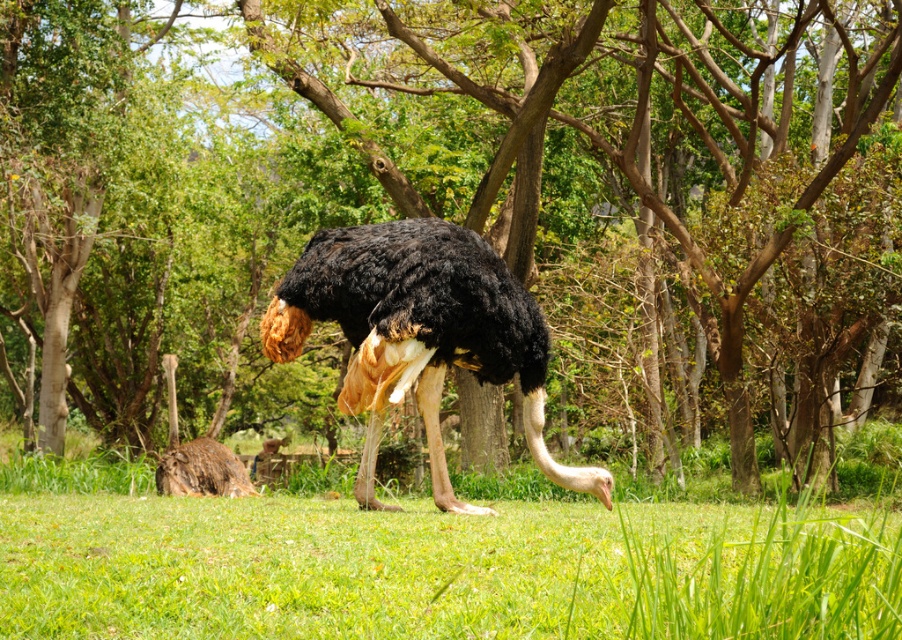
Question: Does green grassy at center have a greater width compared to black feathered ostrich at center?

Choices:
 (A) no
 (B) yes

Answer: (A)

Question: Is green grassy at center above brown feathered ostrich at lower left?

Choices:
 (A) no
 (B) yes

Answer: (B)

Question: Among these objects, which one is nearest to the camera?

Choices:
 (A) brown feathered ostrich at lower left
 (B) black feathered ostrich at center
 (C) green grassy at center

Answer: (C)

Question: Can you confirm if black feathered ostrich at center is positioned to the left of brown feathered ostrich at lower left?

Choices:
 (A) no
 (B) yes

Answer: (A)

Question: Which object appears farthest from the camera in this image?

Choices:
 (A) green grassy at center
 (B) black feathered ostrich at center
 (C) brown feathered ostrich at lower left

Answer: (C)

Question: Considering the real-world distances, which object is closest to the green grassy at center?

Choices:
 (A) brown feathered ostrich at lower left
 (B) black feathered ostrich at center

Answer: (B)